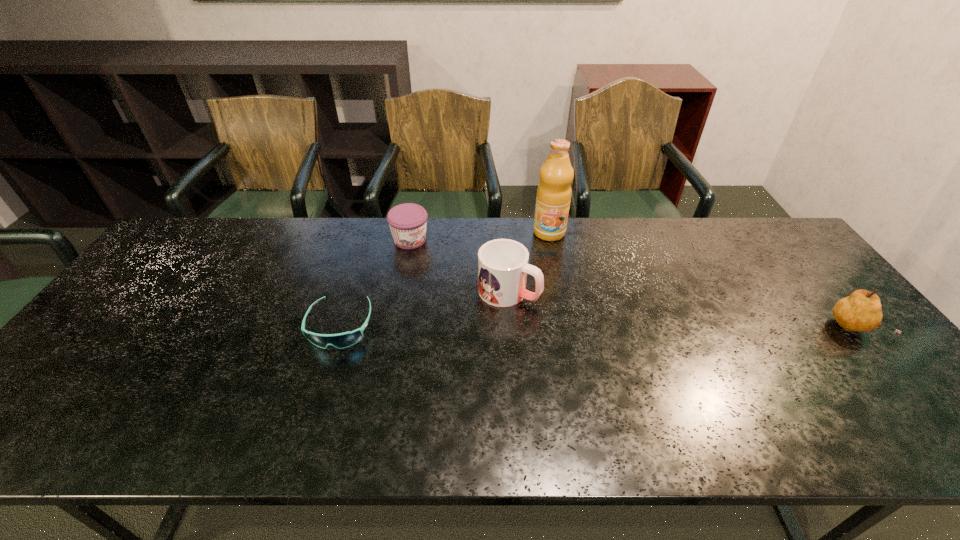
The image size is (960, 540). Identify the location of vacant spot on the desktop that is between the sunglasses and the pear and is positioned on the side of the third object from left to right with the handle. (584, 327).

Where is `vacant spot on the desktop that is between the sunglasses and the rightmost object and is positioned on the front label of the jam`? This screenshot has width=960, height=540. vacant spot on the desktop that is between the sunglasses and the rightmost object and is positioned on the front label of the jam is located at coordinates (525, 327).

The image size is (960, 540). I want to click on free space on the desktop that is between the sunglasses and the pear and is positioned on the front label of the tallest object, so (x=543, y=327).